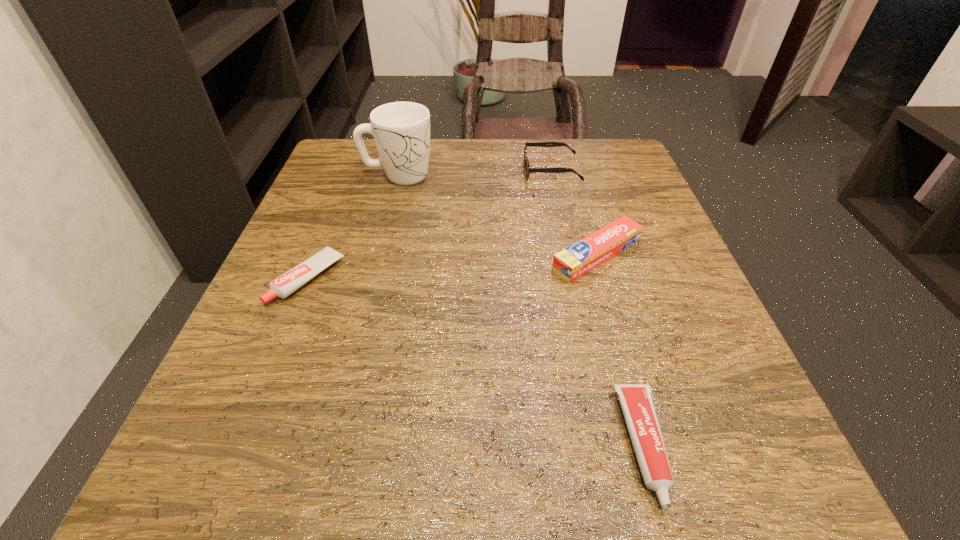
Where is `vacant space at the left edge of the desktop`? vacant space at the left edge of the desktop is located at coordinates (227, 394).

This screenshot has width=960, height=540. In the image, there is a desktop. Find the location of `vacant region at the right edge`. vacant region at the right edge is located at coordinates (594, 212).

Where is `vacant space at the far left corner of the desktop`? vacant space at the far left corner of the desktop is located at coordinates (316, 178).

In the image, there is a desktop. Find the location of `free region at the far right corner`. free region at the far right corner is located at coordinates (644, 188).

Where is `free spot between the fourth shortest object and the leftmost toothpaste`? This screenshot has height=540, width=960. free spot between the fourth shortest object and the leftmost toothpaste is located at coordinates (430, 225).

Identify the location of empty space between the leftmost toothpaste and the nearest toothpaste. (476, 362).

The width and height of the screenshot is (960, 540). What are the coordinates of `free area in between the leftmost toothpaste and the nearest object` in the screenshot? It's located at (476, 362).

Where is `vacant area that lies between the nearest object and the leftmost toothpaste`? vacant area that lies between the nearest object and the leftmost toothpaste is located at coordinates (476, 362).

Find the location of a particular element. Image resolution: width=960 pixels, height=540 pixels. free point between the nearest toothpaste and the mug is located at coordinates (521, 310).

This screenshot has width=960, height=540. I want to click on free space between the leftmost toothpaste and the tallest object, so click(353, 227).